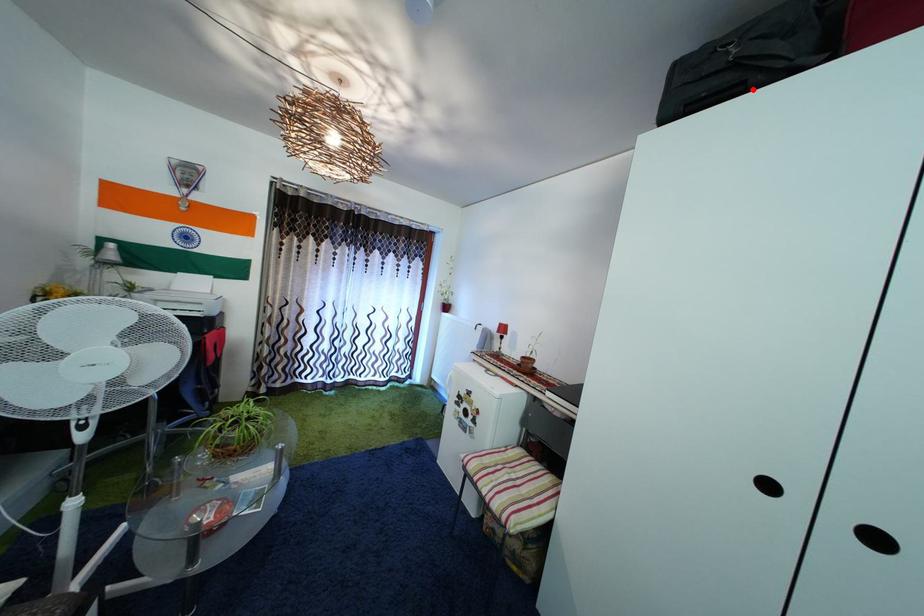
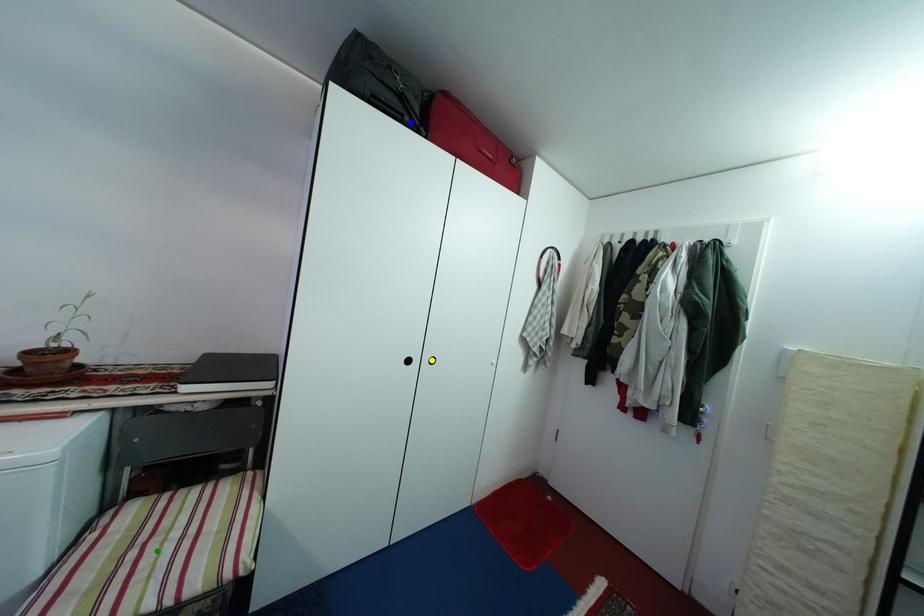
Question: I am providing you with two images of the same scene from different viewpoints. A red point is marked on the first image. You are given multiple points on the second image. Which spot in image 2 lines up with the point in image 1?

Choices:
 (A) yellow point
 (B) green point
 (C) blue point

Answer: (C)